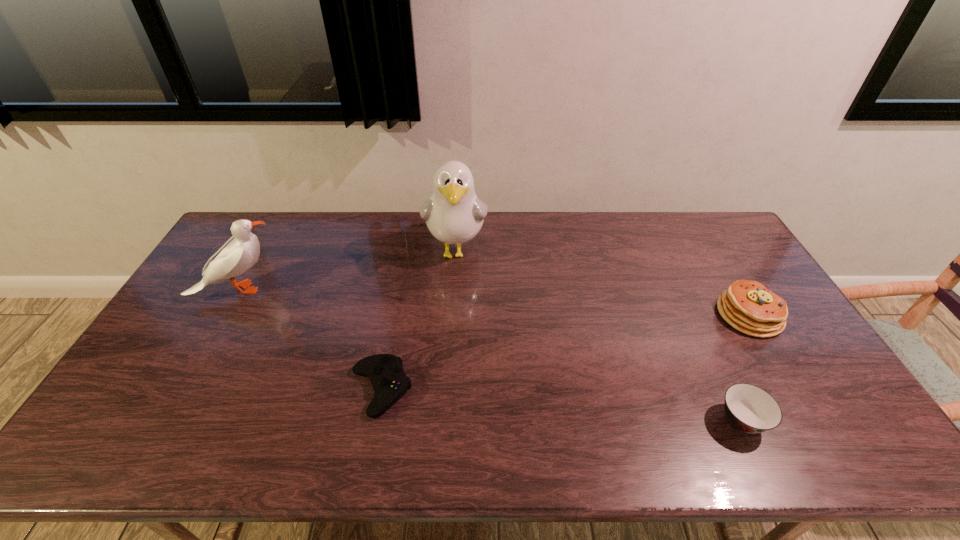
At what (x,y) coordinates should I click in order to perform the action: click on the right gull. Please return your answer as a coordinate pair (x, y). Looking at the image, I should click on (454, 214).

Where is `the tallest object`? This screenshot has height=540, width=960. the tallest object is located at coordinates coord(454,214).

Where is `the shorter gull`? This screenshot has height=540, width=960. the shorter gull is located at coordinates (242, 250).

This screenshot has width=960, height=540. I want to click on the second tallest object, so click(242, 250).

Identify the location of the rightmost object. (748, 306).

In order to click on the third tallest object in this screenshot , I will do `click(748, 306)`.

Where is `the second shortest object`? The height and width of the screenshot is (540, 960). the second shortest object is located at coordinates (749, 408).

I want to click on soup bowl, so click(749, 408).

This screenshot has width=960, height=540. I want to click on control, so click(390, 383).

Where is `blank space located on the beak of the taller gull`? The image size is (960, 540). blank space located on the beak of the taller gull is located at coordinates (450, 348).